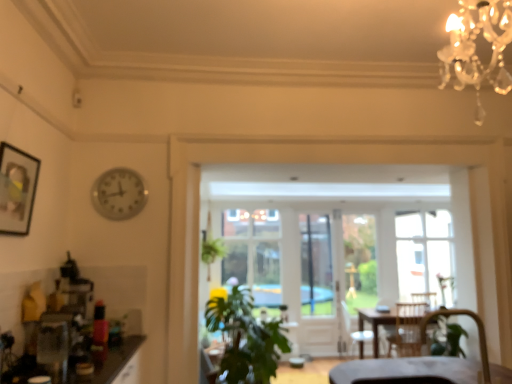
Question: Considering the relative positions of matte black picture frame at upper left and metallic clock at upper left in the image provided, is matte black picture frame at upper left to the left of metallic clock at upper left from the viewer's perspective?

Choices:
 (A) yes
 (B) no

Answer: (A)

Question: Is metallic clock at upper left inside matte black picture frame at upper left?

Choices:
 (A) yes
 (B) no

Answer: (B)

Question: Considering the relative sizes of matte black picture frame at upper left and metallic clock at upper left in the image provided, is matte black picture frame at upper left smaller than metallic clock at upper left?

Choices:
 (A) yes
 (B) no

Answer: (B)

Question: Is matte black picture frame at upper left taller than metallic clock at upper left?

Choices:
 (A) yes
 (B) no

Answer: (A)

Question: Is matte black picture frame at upper left positioned far away from metallic clock at upper left?

Choices:
 (A) no
 (B) yes

Answer: (A)

Question: From a real-world perspective, relative to green leafy plant at center, is wooden armchair at center, which ranks as the 2th armchair in top-to-bottom order, vertically above or below?

Choices:
 (A) below
 (B) above

Answer: (A)

Question: In terms of size, does wooden armchair at center, which is counted as the 2th armchair, starting from the left, appear bigger or smaller than green leafy plant at center?

Choices:
 (A) big
 (B) small

Answer: (B)

Question: In the image, is wooden armchair at center, which is counted as the 1th armchair, starting from the bottom, positioned in front of or behind green leafy plant at center?

Choices:
 (A) front
 (B) behind

Answer: (B)

Question: Is wooden armchair at center, which ranks as the 2th armchair in top-to-bottom order, taller or shorter than green leafy plant at center?

Choices:
 (A) tall
 (B) short

Answer: (B)

Question: In the image, is green leafy plant at center positioned in front of or behind wooden armchair at center, acting as the first armchair starting from the right?

Choices:
 (A) front
 (B) behind

Answer: (A)

Question: Choose the correct answer: Is green leafy plant at center inside wooden armchair at center, which is counted as the 1th armchair, starting from the bottom, or outside it?

Choices:
 (A) outside
 (B) inside

Answer: (A)

Question: Is green leafy plant at center bigger or smaller than wooden armchair at center, acting as the first armchair starting from the right?

Choices:
 (A) small
 (B) big

Answer: (B)

Question: Based on their positions, is green leafy plant at center located to the left or right of wooden armchair at center, the 2th armchair when ordered from front to back?

Choices:
 (A) left
 (B) right

Answer: (A)

Question: Is metallic clock at upper left inside or outside of velvet brown armchair at lower right, which is the 2th armchair in bottom-to-top order?

Choices:
 (A) outside
 (B) inside

Answer: (A)

Question: Is metallic clock at upper left bigger or smaller than velvet brown armchair at lower right, the 1th armchair positioned from the left?

Choices:
 (A) small
 (B) big

Answer: (B)